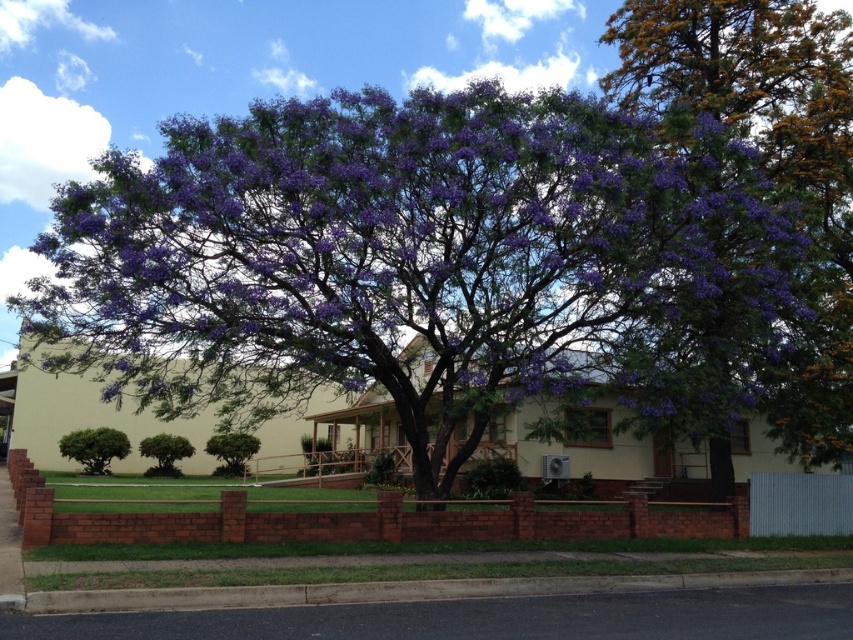
You are a gardener planning to plant a new shrub in this area. You notice the green leafy bush at lower left and the green leafy tree at center. Which one has a wider spread in terms of width?

The green leafy bush at lower left has a wider spread than the green leafy tree at center, as its width surpasses that of the tree.

You are a gardener standing at the edge of the lawn. You need to water both the purple matte flowers at center and the green leafy tree at center. Given that your watering hose can reach up to 15 meters, will you be able to water both without moving the hose? Please explain your reasoning based on their positions.

The distance between the purple matte flowers at center and the green leafy tree at center is 16.50 meters. Since the hose can only reach up to 15 meters, you cannot water both without moving the hose because the distance exceeds the hose length.

You are a gardener who needs to trim bushes. You see the green leafy bush at lower left and the green leafy bush at center. Which bush requires more trimming to reduce its height?

The green leafy bush at lower left is much taller than the green leafy bush at center, so it requires more trimming to reduce its height.